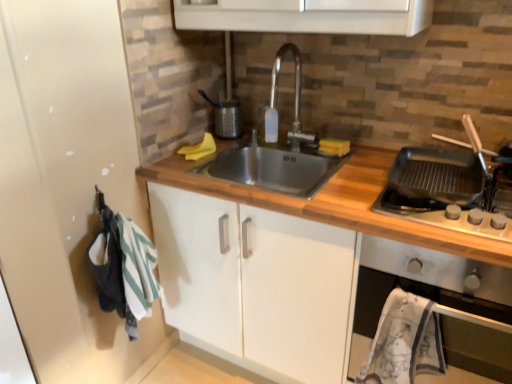
Identify the location of blank space situated above black matte griddle at right (from a real-world perspective). The image size is (512, 384). (448, 173).